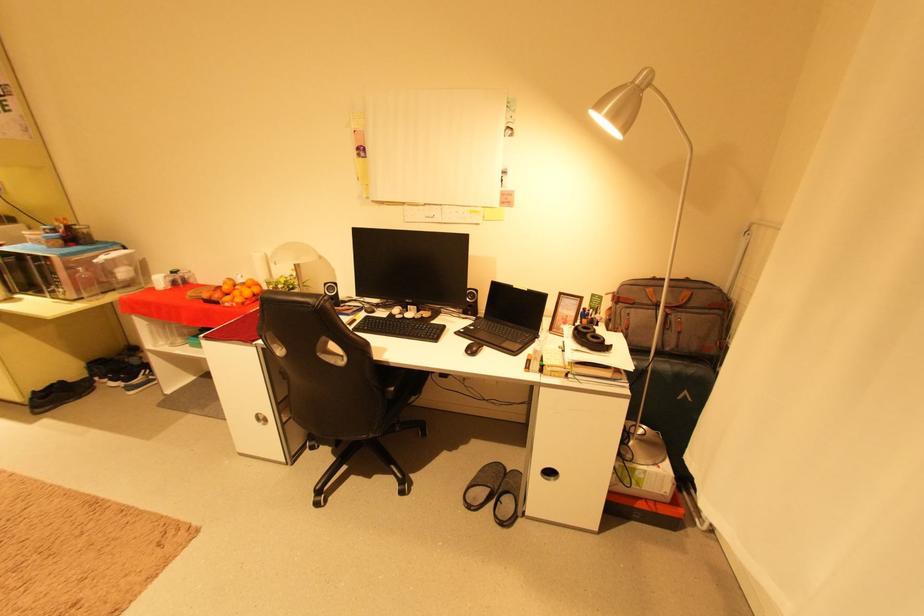
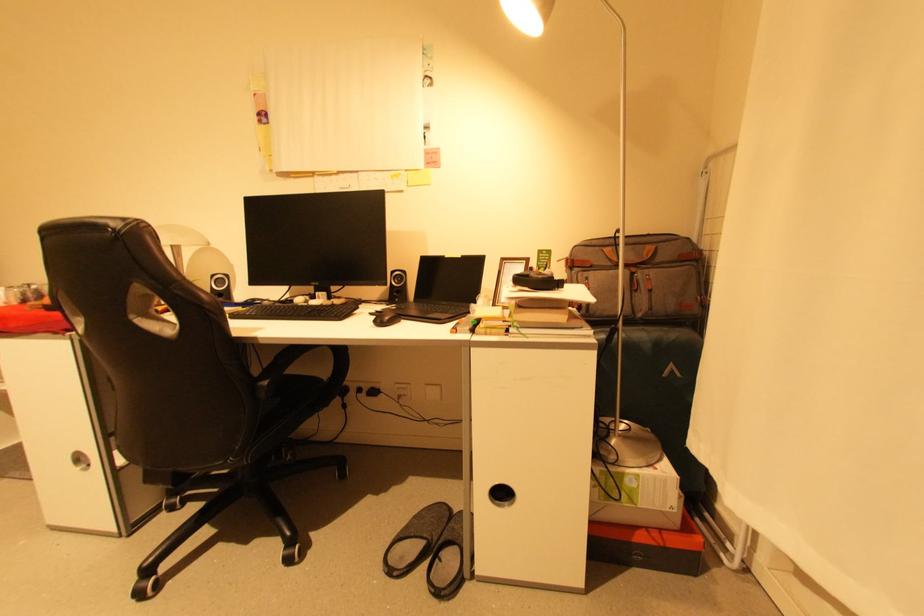
Question: The first image is from the beginning of the video and the second image is from the end. How did the camera likely rotate when shooting the video?

Choices:
 (A) Left
 (B) Right
 (C) Up
 (D) Down

Answer: (C)